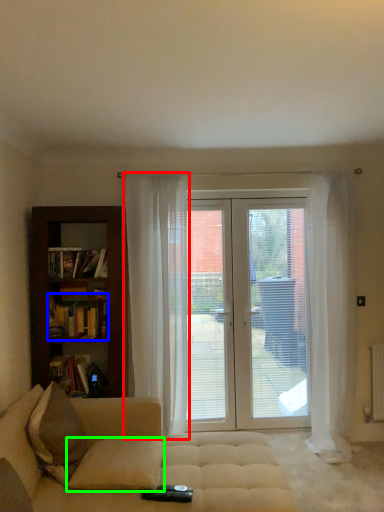
Question: Considering the real-world distances, which object is closest to curtain (highlighted by a red box)? book (highlighted by a blue box) or pillow (highlighted by a green box).

Choices:
 (A) book
 (B) pillow

Answer: (A)